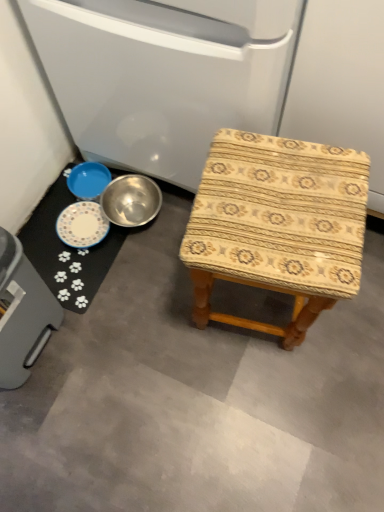
Where is `free region on the left part of wooden-patterned stool at center`? This screenshot has width=384, height=512. free region on the left part of wooden-patterned stool at center is located at coordinates (152, 315).